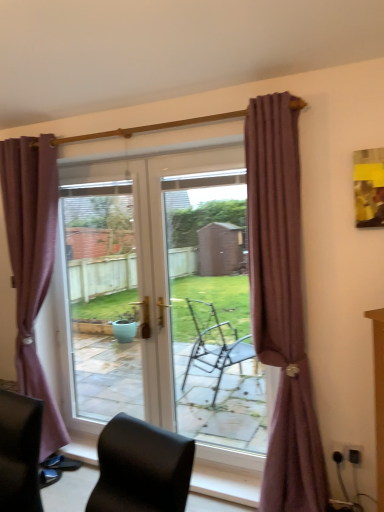
Question: Is black leather chair at lower left smaller than purple fabric curtain at left, the 1th curtain viewed from the back?

Choices:
 (A) no
 (B) yes

Answer: (B)

Question: Can you confirm if black leather chair at lower left is taller than purple fabric curtain at left, which ranks as the 2th curtain in front-to-back order?

Choices:
 (A) no
 (B) yes

Answer: (A)

Question: Is black leather chair at lower left facing away from purple fabric curtain at left, which is counted as the first curtain, starting from the left?

Choices:
 (A) no
 (B) yes

Answer: (A)

Question: Considering the relative positions of black leather chair at lower left and purple fabric curtain at left, which ranks as the 2th curtain in front-to-back order, in the image provided, is black leather chair at lower left to the left of purple fabric curtain at left, which ranks as the 2th curtain in front-to-back order, from the viewer's perspective?

Choices:
 (A) yes
 (B) no

Answer: (A)

Question: Is black leather chair at lower left touching purple fabric curtain at left, the 2th curtain when ordered from right to left?

Choices:
 (A) yes
 (B) no

Answer: (B)

Question: From the image's perspective, is black leather chair at lower left located beneath purple fabric curtain at left, the 2th curtain when ordered from right to left?

Choices:
 (A) yes
 (B) no

Answer: (A)

Question: Is transparent glass door at center outside of purple fabric curtain at left, which is counted as the first curtain, starting from the left?

Choices:
 (A) no
 (B) yes

Answer: (B)

Question: Does transparent glass door at center have a larger size compared to purple fabric curtain at left, the 2th curtain when ordered from right to left?

Choices:
 (A) no
 (B) yes

Answer: (A)

Question: From the image's perspective, is transparent glass door at center beneath purple fabric curtain at left, the 2th curtain when ordered from right to left?

Choices:
 (A) no
 (B) yes

Answer: (B)

Question: Is transparent glass door at center directly adjacent to purple fabric curtain at left, which ranks as the 2th curtain in front-to-back order?

Choices:
 (A) yes
 (B) no

Answer: (B)

Question: Considering the relative sizes of transparent glass door at center and purple fabric curtain at left, which is counted as the first curtain, starting from the left, in the image provided, is transparent glass door at center shorter than purple fabric curtain at left, which is counted as the first curtain, starting from the left,?

Choices:
 (A) no
 (B) yes

Answer: (B)

Question: Considering the relative positions of transparent glass door at center and purple fabric curtain at left, which ranks as the 2th curtain in front-to-back order, in the image provided, is transparent glass door at center to the right of purple fabric curtain at left, which ranks as the 2th curtain in front-to-back order, from the viewer's perspective?

Choices:
 (A) yes
 (B) no

Answer: (A)

Question: Can you confirm if transparent glass door at center is shorter than black leather chair at lower left?

Choices:
 (A) yes
 (B) no

Answer: (B)